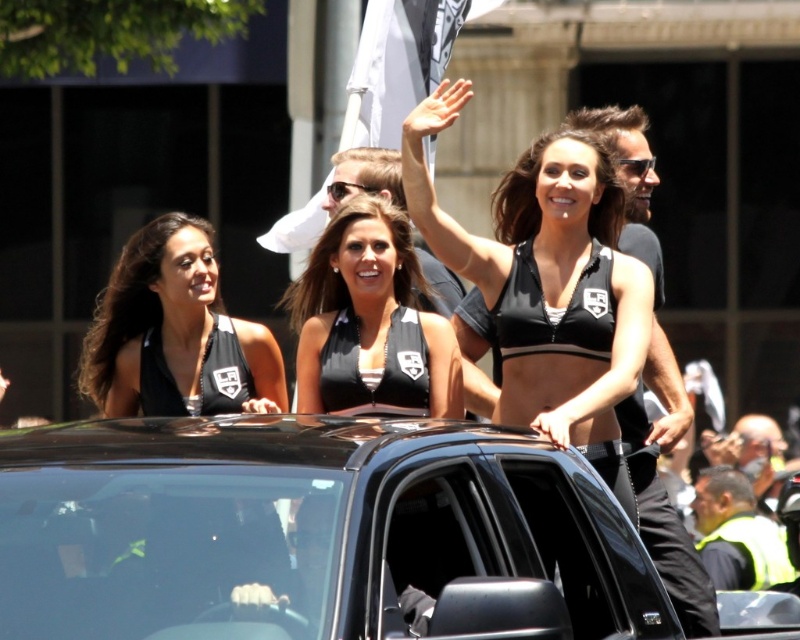
Question: Can you confirm if black matte bikini top at center is positioned below white fabric flag at upper center?

Choices:
 (A) no
 (B) yes

Answer: (B)

Question: Which is farther from the black matte sports bra at upper center?

Choices:
 (A) white fabric flag at upper center
 (B) black matte tank top at upper left

Answer: (B)

Question: Which of the following is the farthest from the observer?

Choices:
 (A) (620, 188)
 (B) (150, 627)
 (C) (442, 344)
 (D) (381, 112)

Answer: (D)

Question: Which object is positioned closest to the white fabric flag at upper center?

Choices:
 (A) black matte bikini top at center
 (B) black matte tank top at upper left
 (C) black glossy suv at center
 (D) black matte sports bra at upper center

Answer: (D)

Question: Considering the relative positions of black glossy suv at center and black matte tank top at upper left in the image provided, where is black glossy suv at center located with respect to black matte tank top at upper left?

Choices:
 (A) right
 (B) left

Answer: (A)

Question: Where is black glossy suv at center located in relation to black matte sports bra at upper center in the image?

Choices:
 (A) left
 (B) right

Answer: (B)